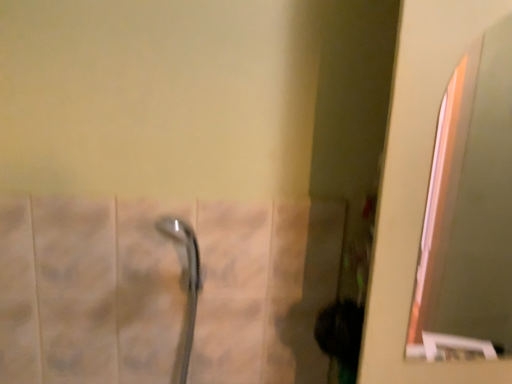
Measure the distance between metallic silver mirror at right and camera.

The depth of metallic silver mirror at right is 1.71 meters.

This screenshot has width=512, height=384. Describe the element at coordinates (469, 214) in the screenshot. I see `metallic silver mirror at right` at that location.

This screenshot has width=512, height=384. In order to click on metallic silver mirror at right in this screenshot , I will do click(469, 214).

Find the location of a particular element. This screenshot has width=512, height=384. metallic silver mirror at right is located at coordinates (469, 214).